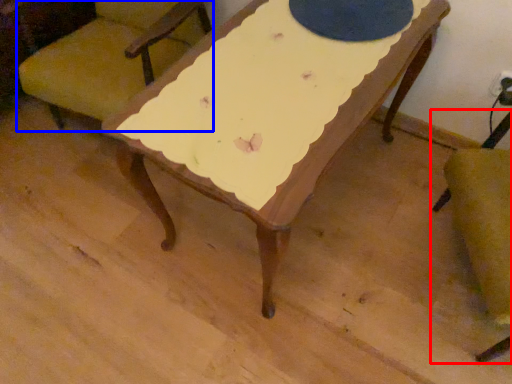
Question: Among these objects, which one is nearest to the camera, chair (highlighted by a red box) or chair (highlighted by a blue box)?

Choices:
 (A) chair
 (B) chair

Answer: (A)